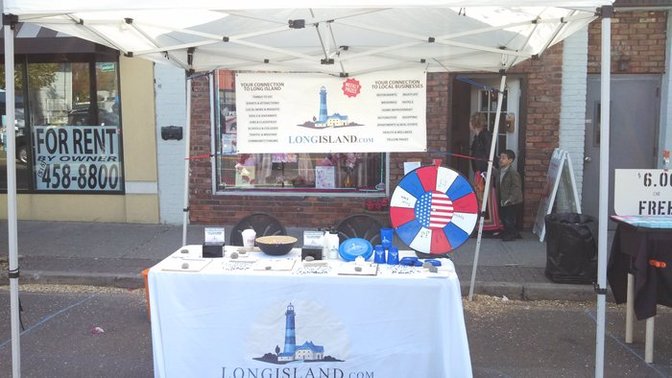
Find the location of a particular element. This screenshot has height=378, width=672. white tablecloth, longisland.com is located at coordinates (267, 279).